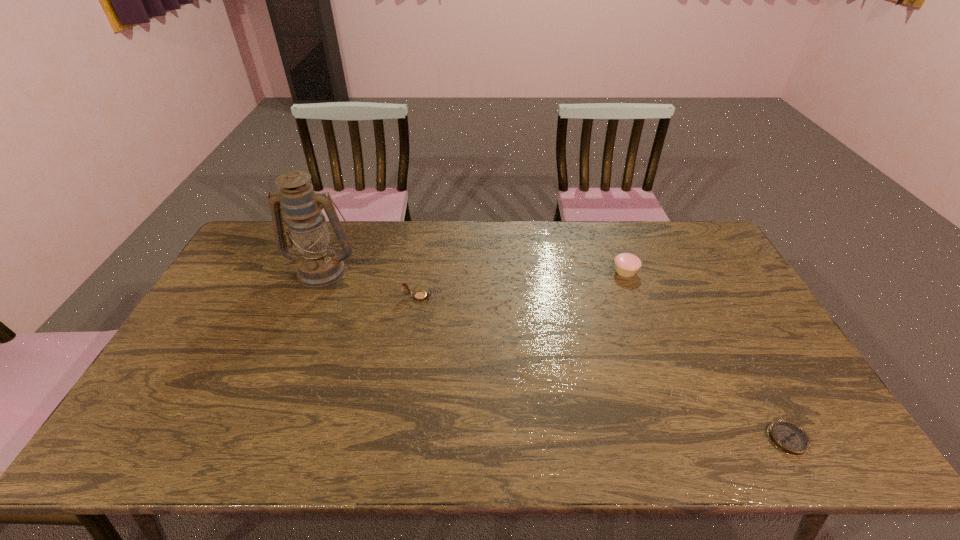
You are a GUI agent. You are given a task and a screenshot of the screen. Output one action in this format:
    pyautogui.click(x=<x>, y=<y>)
    Task: Click on the leftmost object
    The height and width of the screenshot is (540, 960).
    Given the screenshot: What is the action you would take?
    pyautogui.click(x=319, y=265)

This screenshot has height=540, width=960. In order to click on the tallest object in this screenshot , I will do `click(319, 265)`.

This screenshot has height=540, width=960. Identify the location of cupcake. (626, 264).

This screenshot has width=960, height=540. What are the coordinates of `the third farthest object` in the screenshot? It's located at (420, 295).

At what (x,y) coordinates should I click in order to perform the action: click on the taller compass. Please return your answer as a coordinate pair (x, y). This screenshot has height=540, width=960. Looking at the image, I should click on (420, 295).

Locate an element on the screen. This screenshot has width=960, height=540. the shortest object is located at coordinates (788, 437).

Find the location of `the rightmost object`. the rightmost object is located at coordinates (788, 437).

The width and height of the screenshot is (960, 540). Identify the location of blank area located on the front of the oil lamp. (292, 347).

The image size is (960, 540). Find the location of `vacant space located on the right of the cupcake`. vacant space located on the right of the cupcake is located at coordinates (701, 271).

Find the location of a particular element. vacant space located 0.360m on the face of the farther compass is located at coordinates (548, 297).